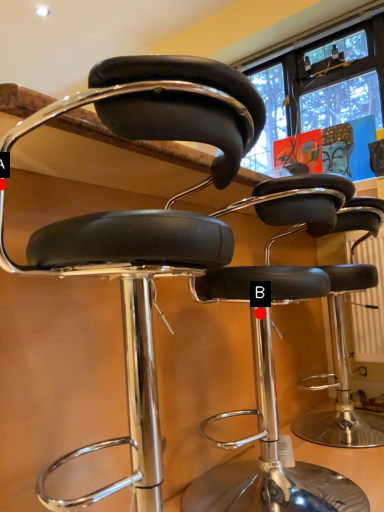
Question: Two points are circled on the image, labeled by A and B beside each circle. Which point is closer to the camera?

Choices:
 (A) A is closer
 (B) B is closer

Answer: (A)